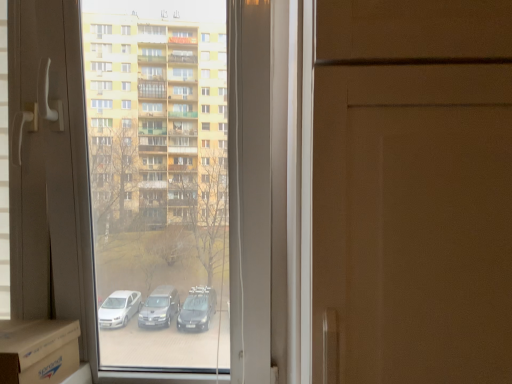
Question: Is cardboard at lower left oriented towards transparent glass window at center?

Choices:
 (A) yes
 (B) no

Answer: (A)

Question: Is the surface of cardboard at lower left in direct contact with transparent glass window at center?

Choices:
 (A) yes
 (B) no

Answer: (B)

Question: Can you confirm if cardboard at lower left is taller than transparent glass window at center?

Choices:
 (A) yes
 (B) no

Answer: (B)

Question: Can we say cardboard at lower left lies outside transparent glass window at center?

Choices:
 (A) yes
 (B) no

Answer: (B)

Question: Does cardboard at lower left lie in front of transparent glass window at center?

Choices:
 (A) yes
 (B) no

Answer: (A)

Question: Does cardboard at lower left lie behind transparent glass window at center?

Choices:
 (A) yes
 (B) no

Answer: (B)

Question: Does transparent glass window at center have a lesser height compared to cardboard at lower left?

Choices:
 (A) no
 (B) yes

Answer: (A)

Question: Can you see transparent glass window at center touching cardboard at lower left?

Choices:
 (A) yes
 (B) no

Answer: (B)

Question: From the image's perspective, does transparent glass window at center appear lower than cardboard at lower left?

Choices:
 (A) no
 (B) yes

Answer: (A)

Question: Is transparent glass window at center at the left side of cardboard at lower left?

Choices:
 (A) yes
 (B) no

Answer: (B)

Question: Does transparent glass window at center appear on the right side of cardboard at lower left?

Choices:
 (A) yes
 (B) no

Answer: (A)

Question: Can you confirm if transparent glass window at center is bigger than cardboard at lower left?

Choices:
 (A) yes
 (B) no

Answer: (A)

Question: From their relative heights in the image, would you say transparent glass window at center is taller or shorter than cardboard at lower left?

Choices:
 (A) short
 (B) tall

Answer: (B)